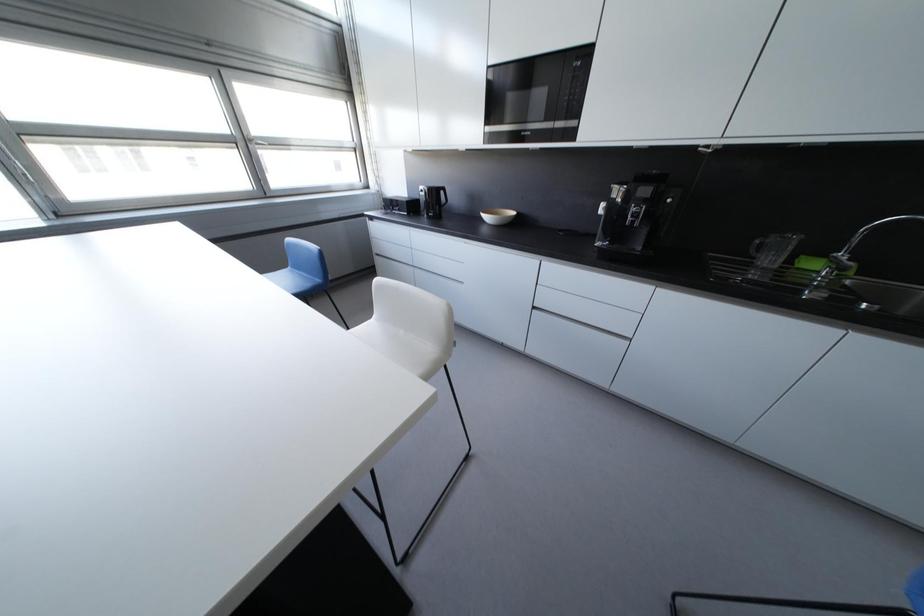
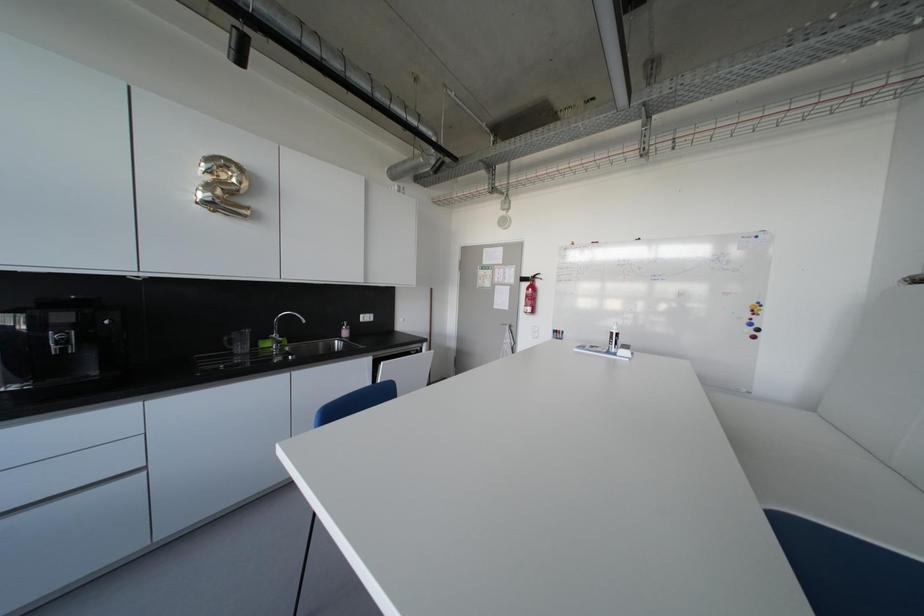
Question: Based on the continuous images, in which direction is the camera rotating? Reply with the corresponding letter.

Choices:
 (A) Left
 (B) Right
 (C) Up
 (D) Down

Answer: (B)